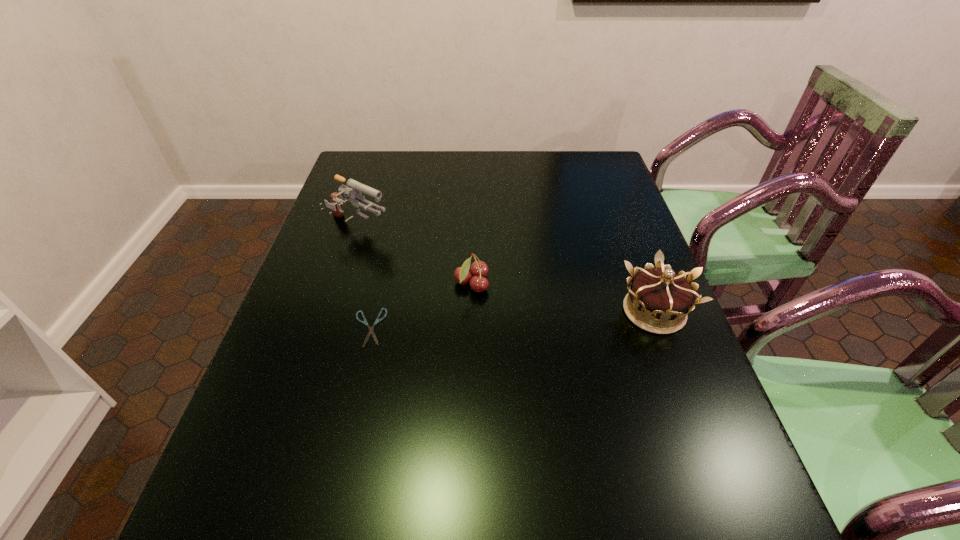
This screenshot has height=540, width=960. I want to click on vacant position located at the barrel end of the gun, so click(x=407, y=250).

Find the location of a particular element. This screenshot has height=540, width=960. vacant space located at the barrel end of the gun is located at coordinates (476, 283).

The width and height of the screenshot is (960, 540). What are the coordinates of `vacant space located at the barrel end of the gun` in the screenshot? It's located at (421, 257).

Locate an element on the screen. The height and width of the screenshot is (540, 960). object that is at the left edge is located at coordinates (353, 189).

Locate an element on the screen. Image resolution: width=960 pixels, height=540 pixels. object situated at the right edge is located at coordinates (656, 296).

Where is `free region at the far edge`? free region at the far edge is located at coordinates (513, 155).

Identify the location of vacant space at the near edge. This screenshot has width=960, height=540. (621, 432).

Locate an element on the screen. The height and width of the screenshot is (540, 960). free space at the left edge of the desktop is located at coordinates (316, 287).

Image resolution: width=960 pixels, height=540 pixels. I want to click on free space at the right edge of the desktop, so click(x=691, y=424).

You are a GUI agent. You are given a task and a screenshot of the screen. Output one action in this format:
    pyautogui.click(x=<x>, y=<y>)
    Task: Click on the free spot between the crown and the shortest object
    
    Given the screenshot: What is the action you would take?
    pyautogui.click(x=512, y=319)